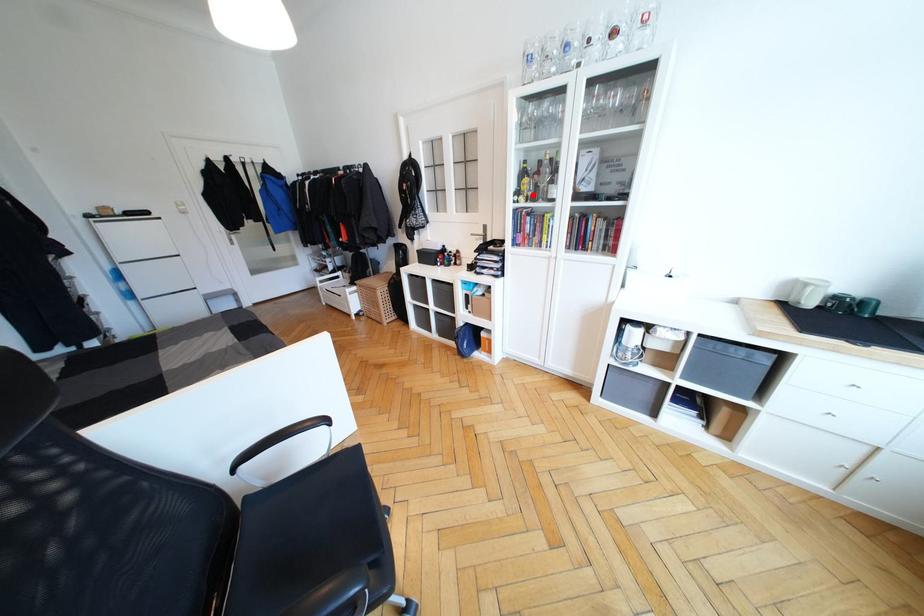
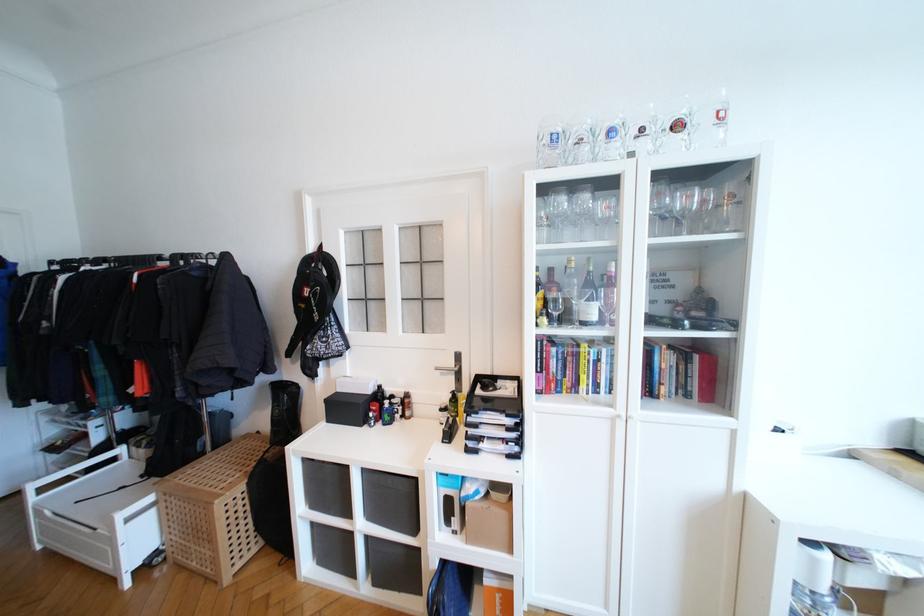
Question: I am providing you with two images of the same scene from different viewpoints. A red point is shown in image1. For the corresponding object point in image2, is it positioned nearer or farther from the camera?

Choices:
 (A) Nearer
 (B) Farther

Answer: (B)